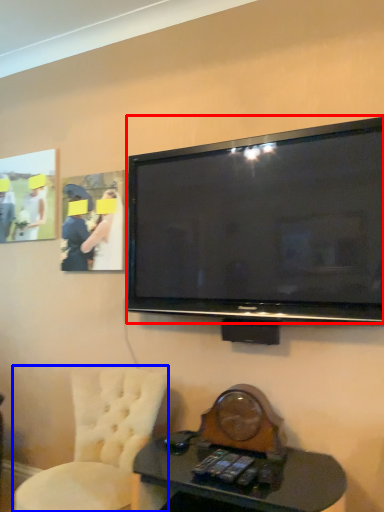
Question: Which object appears farthest to the camera in this image, television (highlighted by a red box) or chair (highlighted by a blue box)?

Choices:
 (A) television
 (B) chair

Answer: (A)